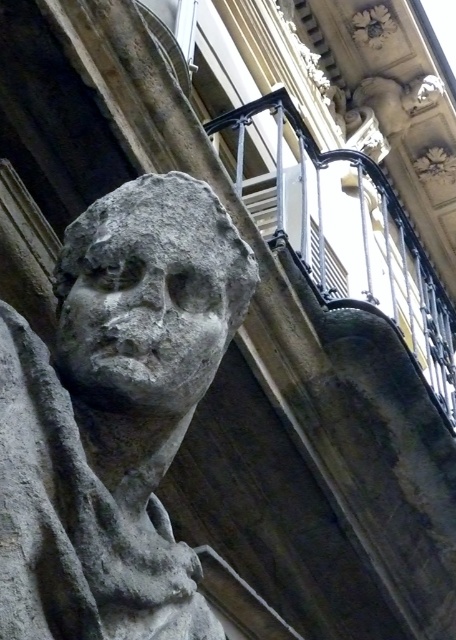
You are an art conservator examining the sculpture. The gray stone bust at center and the gray stone face at center are both part of the same sculpture. Which one is positioned lower?

The gray stone bust at center is positioned lower than the gray stone face at center.

You are an art conservator examining the gray stone bust at center and the gray stone face at center in the image. Which object should you prioritize conserving if you can only treat one due to limited resources, based on their size?

The gray stone bust at center should be prioritized for conservation because it is larger in size than the gray stone face at center, making it potentially more significant or requiring more immediate attention due to its scale.